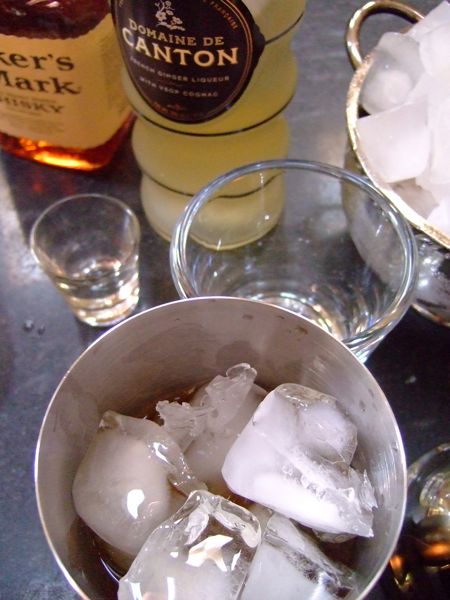
This screenshot has height=600, width=450. Find the location of `ice bucket`. ice bucket is located at coordinates (433, 271).